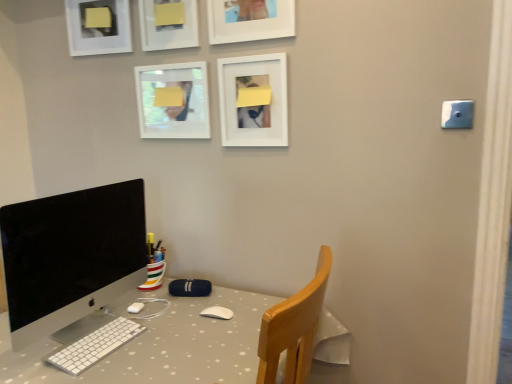
Question: Which direction should I rotate to look at white glossy picture frame at upper center, arranged as the fourth picture frame when viewed from the right, — up or down?

Choices:
 (A) up
 (B) down

Answer: (A)

Question: Can you confirm if white plastic keyboard at lower left is shorter than silver metallic monitor at left?

Choices:
 (A) no
 (B) yes

Answer: (B)

Question: Is white plastic keyboard at lower left with silver metallic monitor at left?

Choices:
 (A) yes
 (B) no

Answer: (B)

Question: Is white plastic keyboard at lower left at the left side of silver metallic monitor at left?

Choices:
 (A) no
 (B) yes

Answer: (A)

Question: Is white plastic keyboard at lower left to the right of silver metallic monitor at left from the viewer's perspective?

Choices:
 (A) yes
 (B) no

Answer: (A)

Question: From the image's perspective, is white plastic keyboard at lower left above silver metallic monitor at left?

Choices:
 (A) no
 (B) yes

Answer: (A)

Question: Does white plastic keyboard at lower left come behind silver metallic monitor at left?

Choices:
 (A) no
 (B) yes

Answer: (B)

Question: Does white matte picture frame at upper center, which ranks as the 1th picture frame in right-to-left order, come in front of matte white picture frame at upper center, which ranks as the 3th picture frame in left-to-right order?

Choices:
 (A) yes
 (B) no

Answer: (A)

Question: Is white matte picture frame at upper center, which ranks as the 1th picture frame in right-to-left order, facing away from matte white picture frame at upper center, which ranks as the third picture frame in right-to-left order?

Choices:
 (A) no
 (B) yes

Answer: (A)

Question: From the image's perspective, is white matte picture frame at upper center, the fifth picture frame in the left-to-right sequence, above matte white picture frame at upper center, which ranks as the 3th picture frame in left-to-right order?

Choices:
 (A) yes
 (B) no

Answer: (B)

Question: Is white matte picture frame at upper center, the fifth picture frame in the left-to-right sequence, outside of matte white picture frame at upper center, which ranks as the third picture frame in right-to-left order?

Choices:
 (A) no
 (B) yes

Answer: (B)

Question: Does white matte picture frame at upper center, the fifth picture frame in the left-to-right sequence, come behind matte white picture frame at upper center, which ranks as the 3th picture frame in left-to-right order?

Choices:
 (A) no
 (B) yes

Answer: (A)

Question: Is white matte picture frame at upper center, which ranks as the 1th picture frame in right-to-left order, oriented towards matte white picture frame at upper center, which ranks as the third picture frame in right-to-left order?

Choices:
 (A) yes
 (B) no

Answer: (B)

Question: Is matte white picture frame at upper center, which ranks as the 3th picture frame in left-to-right order, turned away from blue plastic light switch at upper right?

Choices:
 (A) no
 (B) yes

Answer: (A)